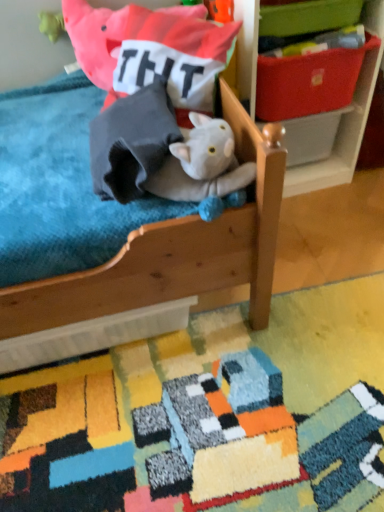
Find the location of a particular element. free space above matte plastic storage box at upper right, the 2th storage box ordered from the bottom (from a real-world perspective) is located at coordinates (307, 41).